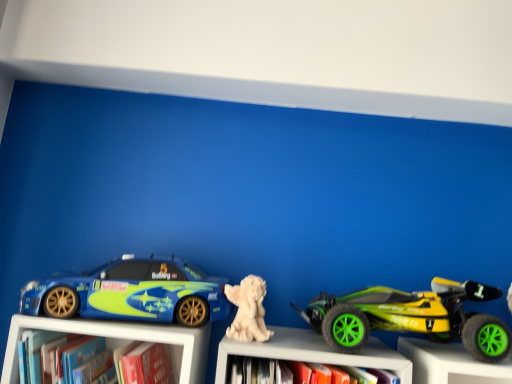
I want to click on white matte statue at center, so click(312, 352).

What do you see at coordinates (131, 293) in the screenshot?
I see `shiny blue car at left` at bounding box center [131, 293].

In order to face green rubber toy car at right, the 2th toy from the left, should I rotate leftwards or rightwards?

It's best to rotate right around 18.335 degrees.

Locate an element on the screen. hardcover book at lower left is located at coordinates (90, 360).

Find the location of a particular element. This screenshot has height=384, width=512. white matte statue at center is located at coordinates (312, 352).

Who is shorter, green rubber toy car at right, positioned as the 1th toy in right-to-left order, or white matte statue at center?

With less height is white matte statue at center.

Based on the photo, is green rubber toy car at right, positioned as the 1th toy in right-to-left order, facing away from white matte statue at center?

No, green rubber toy car at right, positioned as the 1th toy in right-to-left order,'s orientation is not away from white matte statue at center.

From the image's perspective, is green rubber toy car at right, positioned as the 1th toy in right-to-left order, positioned above or below white matte statue at center?

From the image's perspective, green rubber toy car at right, positioned as the 1th toy in right-to-left order, appears above white matte statue at center.

Between shiny blue car at left and hardcover book at lower left, which one appears on the left side from the viewer's perspective?

Positioned to the left is hardcover book at lower left.

From a real-world perspective, is shiny blue car at left above or below hardcover book at lower left?

shiny blue car at left is situated higher than hardcover book at lower left in the real world.

Looking at their sizes, would you say shiny blue car at left is wider or thinner than hardcover book at lower left?

Clearly, shiny blue car at left has less width compared to hardcover book at lower left.

Measure the distance from shiny blue car at left to hardcover book at lower left.

shiny blue car at left and hardcover book at lower left are 4.42 inches apart from each other.

Is hardcover book at lower left outside of green rubber toy car at right, the 2th toy from the left?

Indeed, hardcover book at lower left is completely outside green rubber toy car at right, the 2th toy from the left.

Is hardcover book at lower left aimed at green rubber toy car at right, positioned as the 1th toy in right-to-left order?

No, hardcover book at lower left is not aimed at green rubber toy car at right, positioned as the 1th toy in right-to-left order.

Is hardcover book at lower left wider than green rubber toy car at right, the 2th toy from the left?

No, hardcover book at lower left is not wider than green rubber toy car at right, the 2th toy from the left.

In the image, is hardcover book at lower left positioned in front of or behind green rubber toy car at right, positioned as the 1th toy in right-to-left order?

In the image, hardcover book at lower left appears in front of green rubber toy car at right, positioned as the 1th toy in right-to-left order.

Is the depth of white matte statue at center less than that of green rubber toy car at right, positioned as the 1th toy in right-to-left order?

Yes, the depth of white matte statue at center is less than that of green rubber toy car at right, positioned as the 1th toy in right-to-left order.

Considering the relative sizes of white matte statue at center and green rubber toy car at right, positioned as the 1th toy in right-to-left order, in the image provided, is white matte statue at center bigger than green rubber toy car at right, positioned as the 1th toy in right-to-left order,?

No.

Is white matte statue at center facing away from green rubber toy car at right, positioned as the 1th toy in right-to-left order?

white matte statue at center does not have its back to green rubber toy car at right, positioned as the 1th toy in right-to-left order.

From a real-world perspective, relative to green rubber toy car at right, positioned as the 1th toy in right-to-left order, is white matte statue at center vertically above or below?

white matte statue at center is below green rubber toy car at right, positioned as the 1th toy in right-to-left order.

Is shiny blue car at left at the back of white matte statue at center?

No, white matte statue at center is not facing away from shiny blue car at left.

Considering the positions of objects white matte statue at center and shiny blue car at left in the image provided, who is behind, white matte statue at center or shiny blue car at left?

shiny blue car at left.

Measure the distance between white matte statue at center and shiny blue car at left.

They are 8.13 inches apart.

Is white matte statue at center taller than shiny blue car at left?

Yes.

Looking at this image, from a real-world perspective, who is located lower, green rubber toy car at right, positioned as the 1th toy in right-to-left order, or white matte statue at center, the 2th toy when ordered from right to left?

white matte statue at center, the 2th toy when ordered from right to left.

From the picture: Can you confirm if green rubber toy car at right, positioned as the 1th toy in right-to-left order, is thinner than white matte statue at center, which appears as the 1th toy when viewed from the left?

No.

At what (x,y) coordinates should I click in order to perform the action: click on toy located on the left of green rubber toy car at right, positioned as the 1th toy in right-to-left order. Please return your answer as a coordinate pair (x, y). The width and height of the screenshot is (512, 384). Looking at the image, I should click on (248, 310).

Between point (461, 340) and point (258, 305), which one is positioned in front?

The point (461, 340) is more forward.

Is shiny blue car at left directly adjacent to white matte statue at center, which appears as the 1th toy when viewed from the left?

No.

From a real-world perspective, is shiny blue car at left under white matte statue at center, which appears as the 1th toy when viewed from the left?

No, from a real-world perspective, shiny blue car at left is not under white matte statue at center, which appears as the 1th toy when viewed from the left.

Which is more distant, (68, 302) or (255, 278)?

Point (255, 278)

Locate an element on the screen. Image resolution: width=512 pixels, height=384 pixels. bookcase that is under the green rubber toy car at right, positioned as the 1th toy in right-to-left order (from a real-world perspective) is located at coordinates (312, 352).

The image size is (512, 384). What are the coordinates of `book on the left of shiny blue car at left` in the screenshot? It's located at (90, 360).

Which object lies further to the anchor point hardcover book at lower left, shiny blue car at left or green rubber toy car at right, the 2th toy from the left?

The object further to hardcover book at lower left is green rubber toy car at right, the 2th toy from the left.

Based on their spatial positions, is shiny blue car at left or hardcover book at lower left closer to white matte statue at center?

The object closer to white matte statue at center is shiny blue car at left.

Which object lies further to the anchor point white matte statue at center, the 2th toy when ordered from right to left, white matte statue at center or shiny blue car at left?

shiny blue car at left lies further to white matte statue at center, the 2th toy when ordered from right to left, than the other object.

Estimate the real-world distances between objects in this image. Which object is closer to white matte statue at center, white matte statue at center, which appears as the 1th toy when viewed from the left, or shiny blue car at left?

white matte statue at center, which appears as the 1th toy when viewed from the left, is positioned closer to the anchor white matte statue at center.

Estimate the real-world distances between objects in this image. Which object is closer to white matte statue at center, the 2th toy when ordered from right to left, hardcover book at lower left or white matte statue at center?

white matte statue at center.

Estimate the real-world distances between objects in this image. Which object is closer to hardcover book at lower left, green rubber toy car at right, the 2th toy from the left, or white matte statue at center?

white matte statue at center lies closer to hardcover book at lower left than the other object.

From the image, which object appears to be farther from shiny blue car at left, hardcover book at lower left or white matte statue at center?

white matte statue at center is further to shiny blue car at left.

When comparing their distances from white matte statue at center, which appears as the 1th toy when viewed from the left, does green rubber toy car at right, positioned as the 1th toy in right-to-left order, or hardcover book at lower left seem further?

Among the two, hardcover book at lower left is located further to white matte statue at center, which appears as the 1th toy when viewed from the left.

Where is `car between hardcover book at lower left and green rubber toy car at right, the 2th toy from the left`? This screenshot has height=384, width=512. car between hardcover book at lower left and green rubber toy car at right, the 2th toy from the left is located at coordinates (131, 293).

I want to click on toy between hardcover book at lower left and white matte statue at center, so click(248, 310).

The height and width of the screenshot is (384, 512). I want to click on car between hardcover book at lower left and white matte statue at center from left to right, so click(x=131, y=293).

Find the location of a particular element. bookcase between shiny blue car at left and green rubber toy car at right, the 2th toy from the left, from left to right is located at coordinates (312, 352).